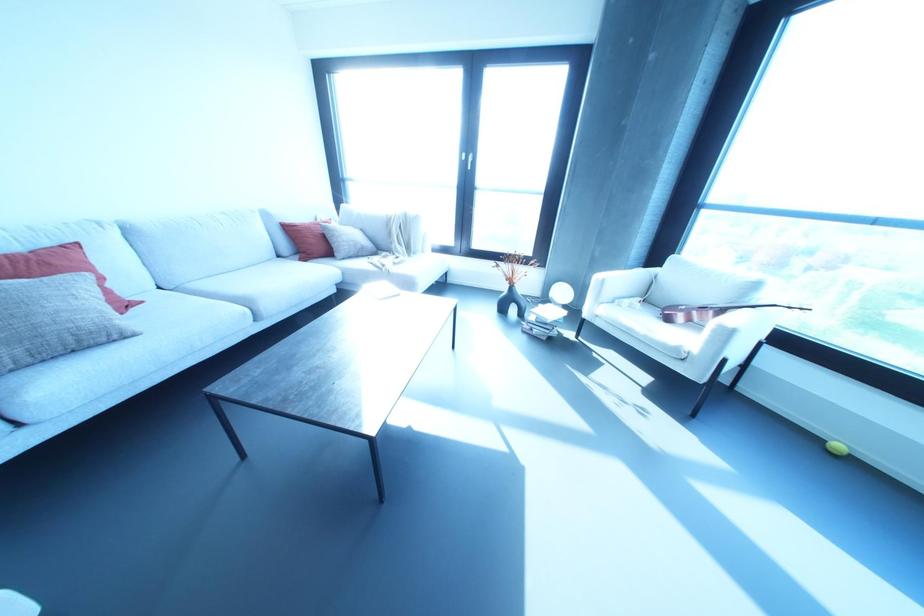
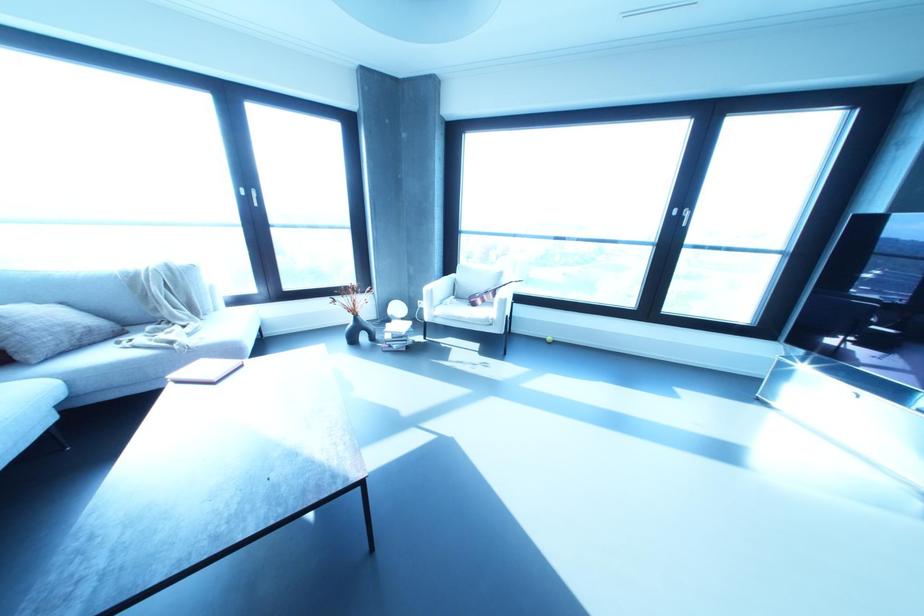
Locate, in the second image, the point that corresponds to pixel 543 339 in the first image.

(404, 349)